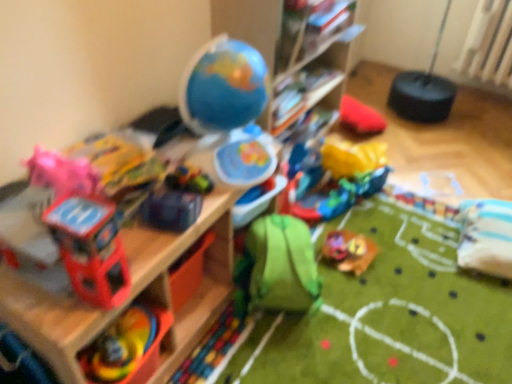
Question: Based on their positions, is white plastic radiator at upper right located to the left or right of green fabric backpack at center, which appears as the 2th toy when viewed from the right?

Choices:
 (A) left
 (B) right

Answer: (B)

Question: Is white plastic radiator at upper right situated inside green fabric backpack at center, which appears as the 2th toy when viewed from the right, or outside?

Choices:
 (A) inside
 (B) outside

Answer: (B)

Question: Estimate the real-world distances between objects in this image. Which object is farther from the shiny plastic toy car at center, which is the 1th toy in back-to-front order?

Choices:
 (A) multicolored plastic toy at lower left, the fourth toy from the back
 (B) wooden shelf at upper left, which is counted as the 1th shelf, starting from the bottom
 (C) wooden shelf at upper center, acting as the first shelf starting from the top
 (D) shiny blue car at center, placed as the third toy when sorted from left to right
 (E) green fabric backpack at center, which appears as the 2th toy when viewed from the right

Answer: (A)

Question: Based on their relative distances, which object is farther from the green fabric backpack at center, acting as the fourth toy starting from the left?

Choices:
 (A) white plastic radiator at upper right
 (B) shiny blue car at center, which is counted as the 3th toy, starting from the back
 (C) shiny plastic toy car at center, acting as the 1th toy starting from the right
 (D) wooden shelf at upper center, positioned as the second shelf in bottom-to-top order
 (E) matte plastic toy helicopter at left, which ranks as the fifth toy in back-to-front order

Answer: (A)